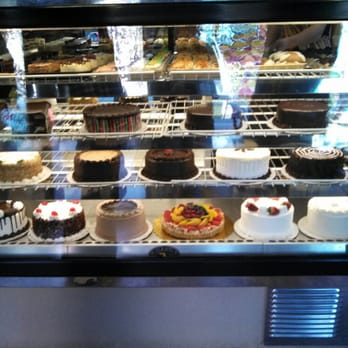
Locate an element on the screen. The width and height of the screenshot is (348, 348). shelf is located at coordinates (145, 245), (198, 180), (207, 130), (278, 76).